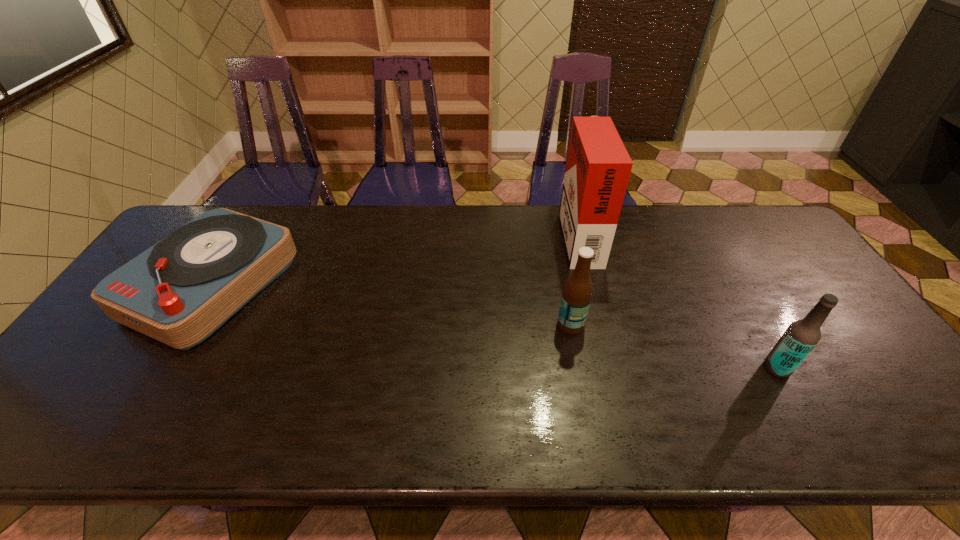
This screenshot has height=540, width=960. I want to click on blank area in the image that satisfies the following two spatial constraints: 1. on the front-facing side of the cigarette case; 2. on the front side of the left beer bottle, so click(602, 325).

Where is `vacant position in the image that satisfies the following two spatial constraints: 1. on the front side of the leftmost object; 2. on the right side of the left beer bottle`? The height and width of the screenshot is (540, 960). vacant position in the image that satisfies the following two spatial constraints: 1. on the front side of the leftmost object; 2. on the right side of the left beer bottle is located at coordinates (188, 325).

The width and height of the screenshot is (960, 540). I want to click on blank area in the image that satisfies the following two spatial constraints: 1. on the front-facing side of the tallest object; 2. on the front side of the shortest object, so click(592, 286).

At what (x,y) coordinates should I click in order to perform the action: click on blank area in the image that satisfies the following two spatial constraints: 1. on the front-facing side of the cigarette case; 2. on the front side of the left beer bottle. Please return your answer as a coordinate pair (x, y). The image size is (960, 540). Looking at the image, I should click on (602, 325).